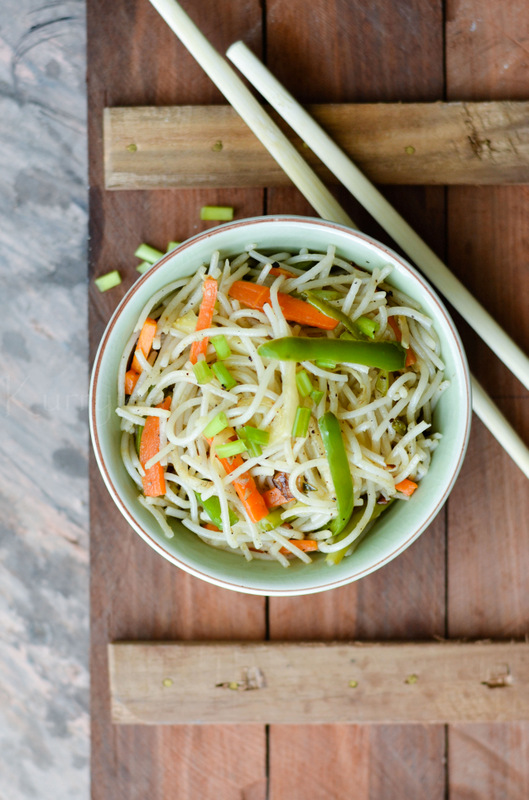
The height and width of the screenshot is (800, 529). Find the location of `spilled pieces of food`. spilled pieces of food is located at coordinates (102, 276), (211, 213), (141, 250), (142, 264), (175, 240).